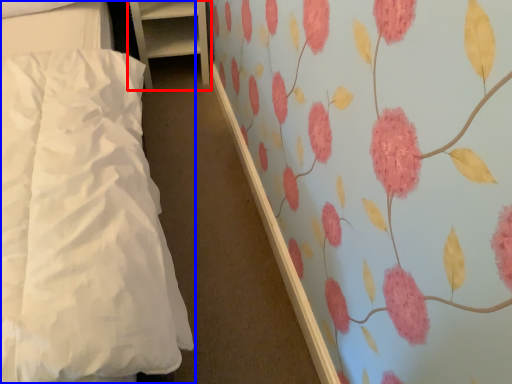
Question: Which object is further to the camera taking this photo, furniture (highlighted by a red box) or bed (highlighted by a blue box)?

Choices:
 (A) furniture
 (B) bed

Answer: (A)